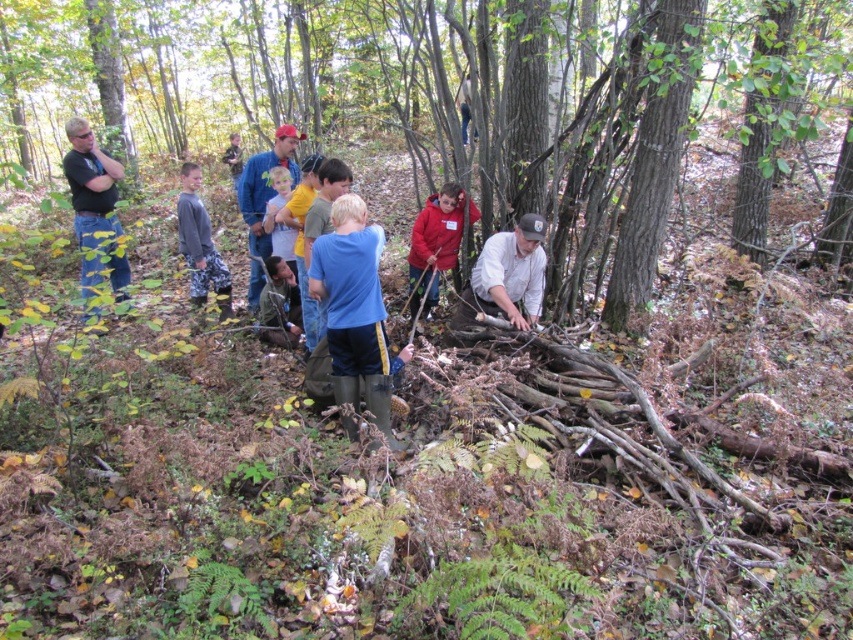
You are standing at the point marked as point (354, 310). What object is exactly at your current position?

The blue rubber boots at center are located at point (354, 310).

You are organizing a group photo and need to arrange the participants based on their clothing sizes. You have a black shirt at left and a red fleece jacket at center. Which clothing item should be placed in the front row to ensure visibility?

The black shirt at left is bigger than the red fleece jacket at center, so placing the black shirt at left in the front row would ensure better visibility as it is larger and can be seen more easily.